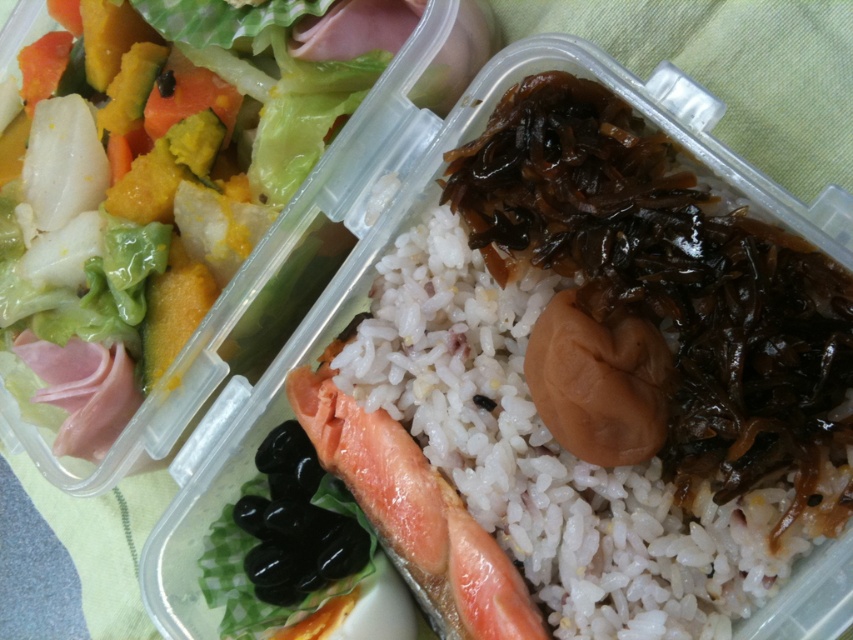
Looking at this image, you are a food delivery robot instructed to deliver this bento box to a customer. Your task is to identify the position of the white polished rice at center relative to the salad in the left compartment. Can you determine if it is positioned to the left, right, above, or below the salad?

The white polished rice at center is located at point [550,456], which is to the right of the salad in the left compartment.

You are a food critic evaluating the arrangement of this bento box. Which compartment has the white polished rice at center and where is it positioned relative to the shiny green lettuce at upper left?

The white polished rice at center is located in the right compartment and is positioned below the shiny green lettuce at upper left.

You are looking at the bento box from above. There are two points marked on the image. The first point is at coordinates point (447, 396) and the second is at point (267, 272). Which point is closer to you when viewed from above?

Point (447, 396) is in front of point (267, 272) when viewed from above, so it is closer to you.